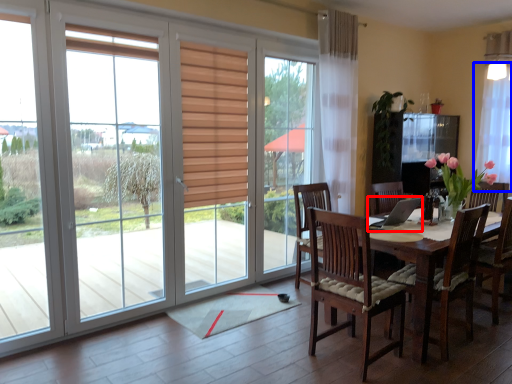
Question: Among these objects, which one is nearest to the camera, laptop (highlighted by a red box) or curtain (highlighted by a blue box)?

Choices:
 (A) laptop
 (B) curtain

Answer: (A)